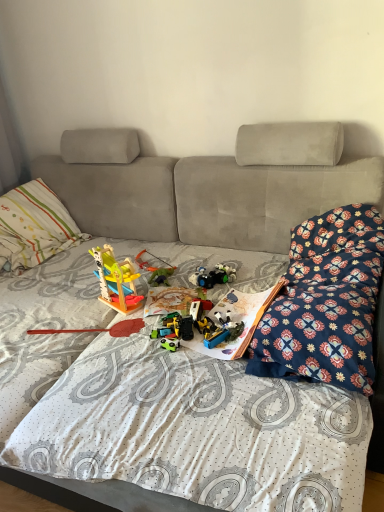
Where is `vacant area on top of wooden toy at center, the first toy from the back (from a real-world perspective)`? This screenshot has height=512, width=384. vacant area on top of wooden toy at center, the first toy from the back (from a real-world perspective) is located at coordinates (156, 257).